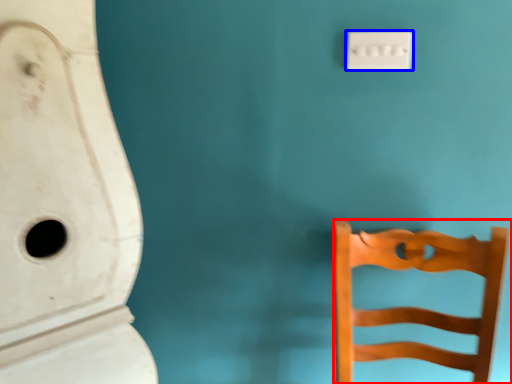
Question: Among these objects, which one is nearest to the camera, furniture (highlighted by a red box) or light switch (highlighted by a blue box)?

Choices:
 (A) furniture
 (B) light switch

Answer: (A)